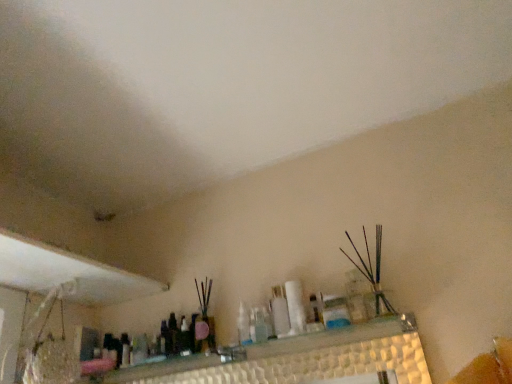
Find the location of `translucent glass counter at lower center`. translucent glass counter at lower center is located at coordinates (300, 359).

What do you see at coordinates (300, 359) in the screenshot? I see `translucent glass counter at lower center` at bounding box center [300, 359].

The image size is (512, 384). I want to click on translucent glass counter at lower center, so click(x=300, y=359).